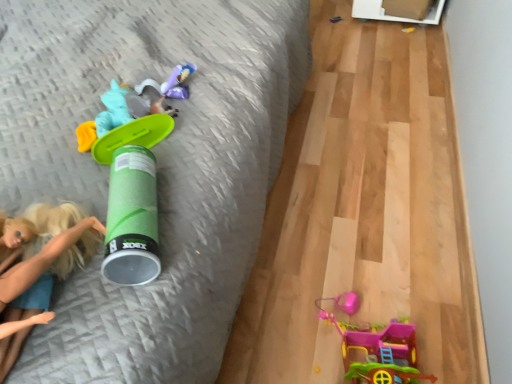
Where is `vacant area situated below plastic pink toy house at lower right, which ranks as the 4th toy in back-to-front order (from a real-world perspective)`? This screenshot has width=512, height=384. vacant area situated below plastic pink toy house at lower right, which ranks as the 4th toy in back-to-front order (from a real-world perspective) is located at coordinates [371, 336].